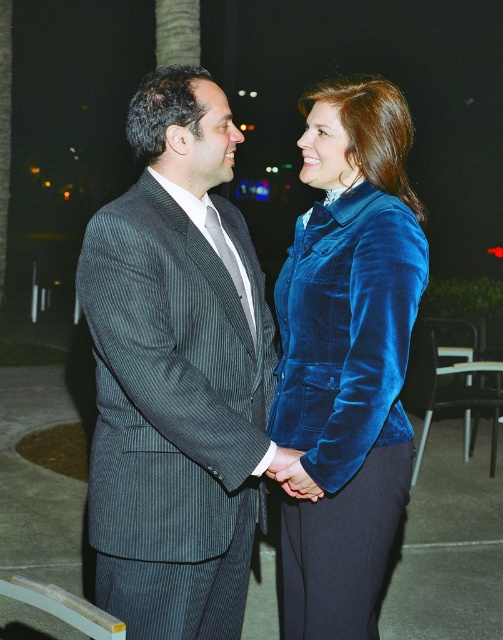
Where is `pinstriped suit at center`? This screenshot has width=503, height=640. pinstriped suit at center is located at coordinates (176, 372).

Can you confirm if pinstriped suit at center is bigger than velvet blue jacket at center?

No, pinstriped suit at center is not bigger than velvet blue jacket at center.

At what (x,y) coordinates should I click in order to perform the action: click on pinstriped suit at center. Please return your answer as a coordinate pair (x, y). Looking at the image, I should click on (176, 372).

Between point (301, 627) and point (274, 472), which one is positioned in front?

Point (274, 472) is in front.

This screenshot has width=503, height=640. What do you see at coordinates (348, 355) in the screenshot?
I see `velvet blue jacket at center` at bounding box center [348, 355].

Where is `velvet blue jacket at center`? This screenshot has height=640, width=503. velvet blue jacket at center is located at coordinates (348, 355).

Is the position of pinstriped suit at center more distant than that of velvet blue hand at center?

No, it is in front of velvet blue hand at center.

Is pinstriped suit at center bigger than velvet blue hand at center?

Yes.

Which is behind, point (250, 250) or point (295, 451)?

Point (250, 250)

Image resolution: width=503 pixels, height=640 pixels. In order to click on pinstriped suit at center in this screenshot , I will do `click(176, 372)`.